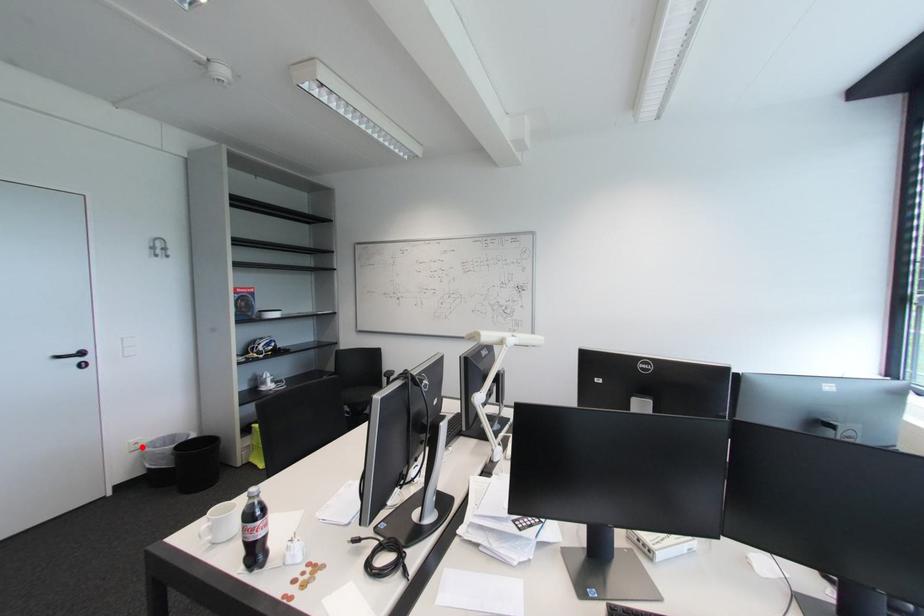
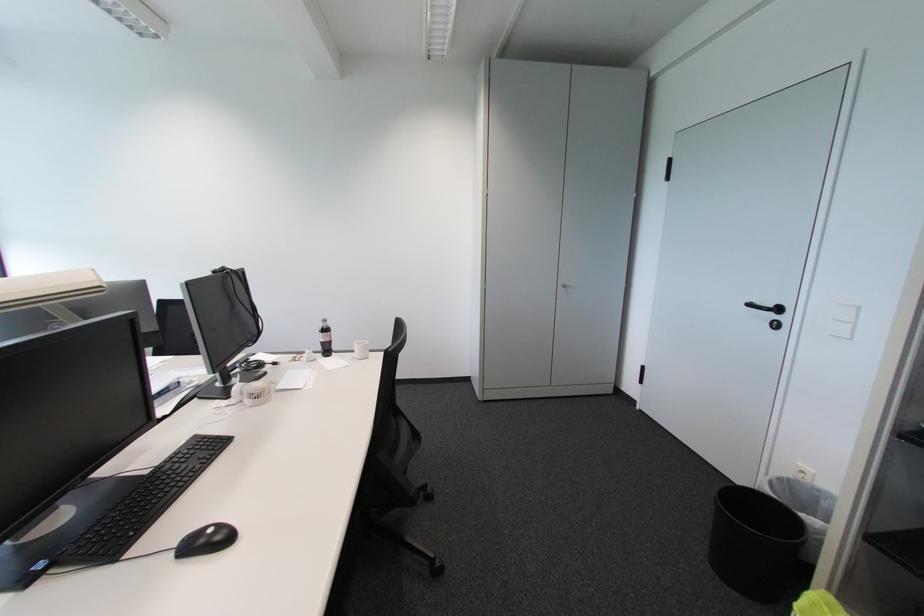
Where in the second image is the point corresponding to the highlighted location from the first image?

(809, 477)